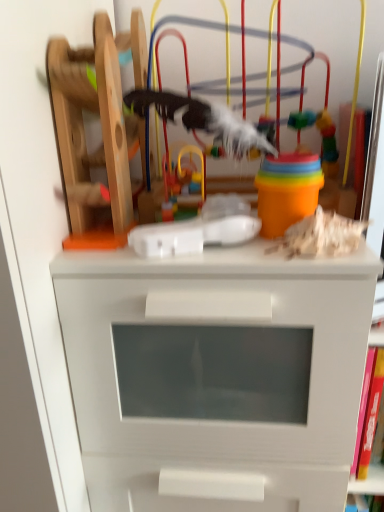
This screenshot has height=512, width=384. Identify the location of free space on the front side of multicolored plastic toy at center, which appears as the 3th toy when viewed from the right. (199, 260).